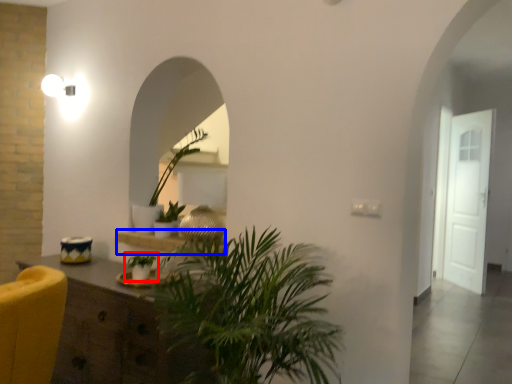
Question: Which object is closer to the camera taking this photo, houseplant (highlighted by a red box) or shelf (highlighted by a blue box)?

Choices:
 (A) houseplant
 (B) shelf

Answer: (A)